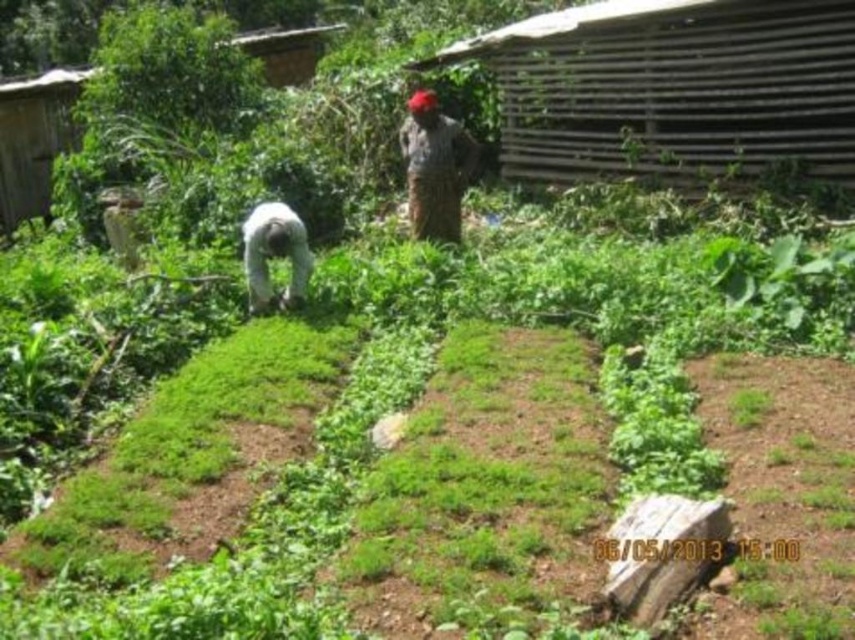
Between dark gray fabric at center and white fabric at center, which one is positioned higher?

dark gray fabric at center

Based on the photo, is dark gray fabric at center in front of white fabric at center?

That is False.

You are a GUI agent. You are given a task and a screenshot of the screen. Output one action in this format:
    pyautogui.click(x=<x>, y=<y>)
    Task: Click on the dark gray fabric at center
    
    Given the screenshot: What is the action you would take?
    pyautogui.click(x=435, y=168)

Identify the location of dark gray fabric at center. The image size is (855, 640). (435, 168).